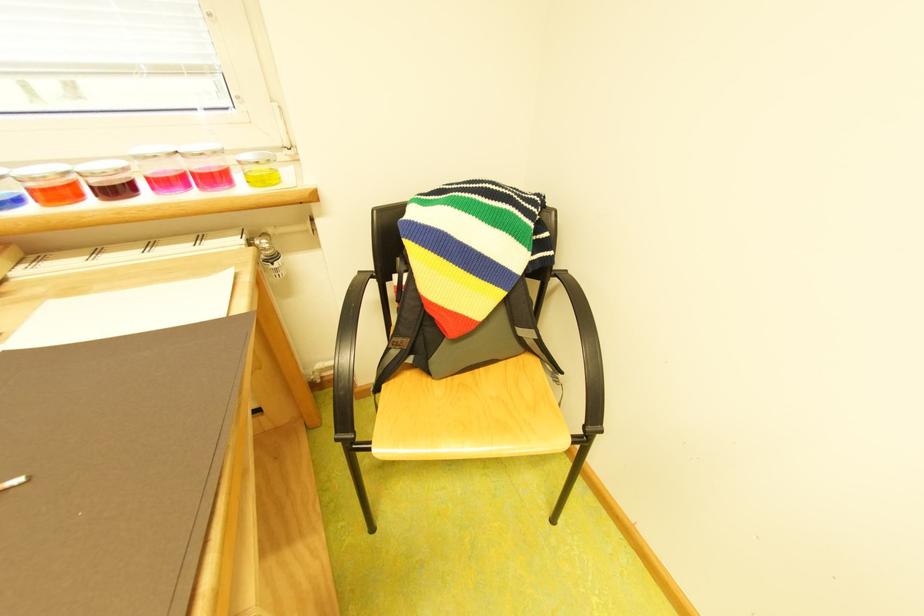
Identify the location of silver thermostat valve. This screenshot has height=616, width=924. (273, 262).